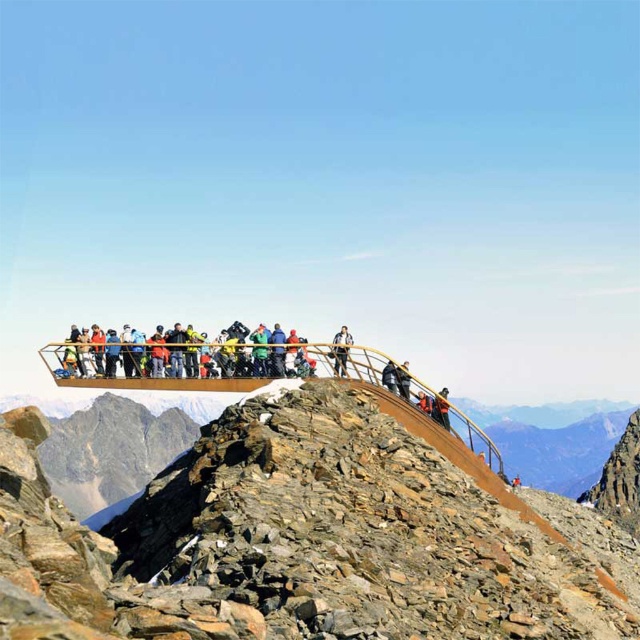
Question: Is matte black jacket at center smaller than orange life vest at center?

Choices:
 (A) no
 (B) yes

Answer: (A)

Question: Which of the following is the farthest from the observer?

Choices:
 (A) (392, 362)
 (B) (77, 352)
 (C) (406, 388)

Answer: (B)

Question: Which of the following is the closest to the observer?

Choices:
 (A) click(x=340, y=374)
 (B) click(x=419, y=401)

Answer: (A)

Question: Can you confirm if orange life vest at center is bigger than orange reflective jacket at center?

Choices:
 (A) no
 (B) yes

Answer: (B)

Question: Does rustic stone mountain at upper center lie in front of orange reflective jacket at center?

Choices:
 (A) yes
 (B) no

Answer: (A)

Question: Which object is positioned closest to the light brown wooden railing at center?

Choices:
 (A) orange life vest at center
 (B) matte black jacket at center
 (C) rustic stone mountain at upper center
 (D) orange reflective jacket at center

Answer: (D)